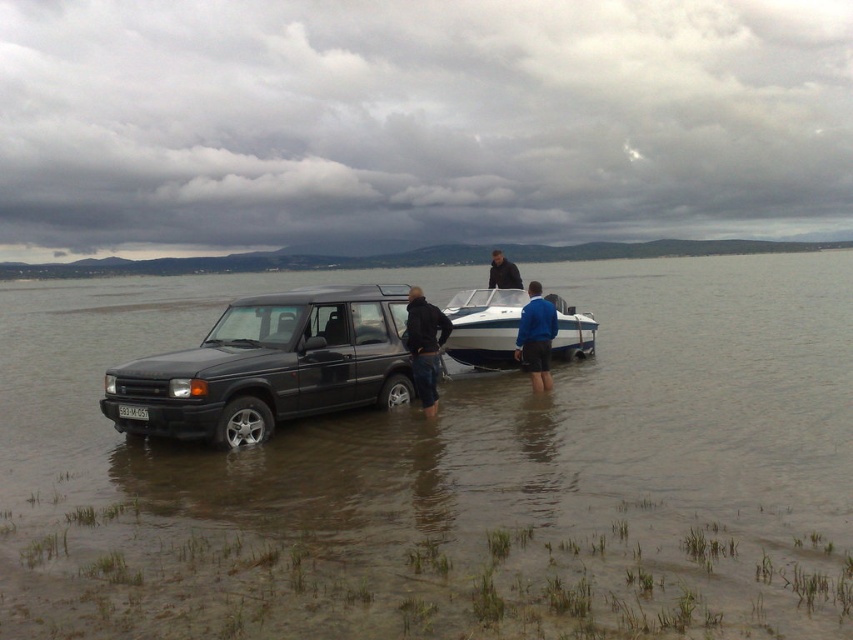
You are a hiker who needs to choose a jacket to keep warm. Both the blue fabric jacket at center and the dark brown leather jacket at center are available. Which jacket would be better for insulation based on their sizes?

The dark brown leather jacket at center is larger in size compared to the blue fabric jacket at center, so it might provide better insulation due to its larger size.

You are a lifeguard on duty at the coastal area shown. You need to quickly reach both the blue fabric jacket at center and the dark brown leather jacket at center to check for safety. Can you carry both jackets at once if your armspan is 1.8 meters?

The distance between the blue fabric jacket at center and dark brown leather jacket at center is 3.44 meters, which is greater than your armspan of 1.8 meters. Therefore, you cannot carry both jackets at once.

You are a lifeguard on duty at the beach. You notice the clear water at center and the white glossy boat at center. Which one is wider from your observation?

The clear water at center might be wider than white glossy boat at center according to the description.